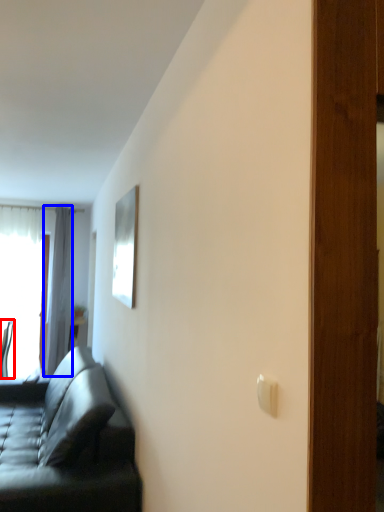
Question: Which object appears farthest to the camera in this image, chair (highlighted by a red box) or curtain (highlighted by a blue box)?

Choices:
 (A) chair
 (B) curtain

Answer: (B)